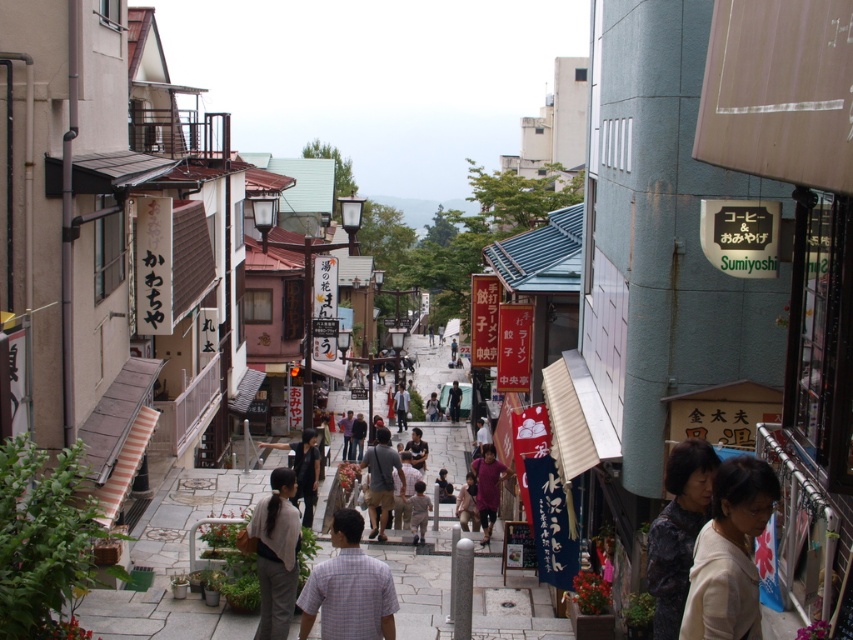
Does light brown leather bag at center have a smaller size compared to dark gray shirt at center?

A: Yes.

From the picture: Measure the distance from light brown leather bag at center to dark gray shirt at center.

light brown leather bag at center is 22.28 meters away from dark gray shirt at center.

Which is in front, point (380, 460) or point (346, 456)?

Point (380, 460) is in front.

The height and width of the screenshot is (640, 853). I want to click on light brown leather bag at center, so click(x=381, y=481).

Can you confirm if matte purple shirt at center is taller than dark gray shirt at center?

Yes.

Measure the distance from matte purple shirt at center to dark gray shirt at center.

matte purple shirt at center is 15.65 meters from dark gray shirt at center.

Does point (482, 458) lie behind point (346, 440)?

No, it is not.

Where is `matte purple shirt at center`? The image size is (853, 640). matte purple shirt at center is located at coordinates (488, 486).

Can you confirm if light beige sweater at lower right is smaller than light brown leather bag at center?

Actually, light beige sweater at lower right might be larger than light brown leather bag at center.

Measure the distance from light beige sweater at lower right to light brown leather bag at center.

light beige sweater at lower right and light brown leather bag at center are 38.59 feet apart.

Locate an element on the screen. This screenshot has width=853, height=640. light beige sweater at lower right is located at coordinates (729, 554).

At what (x,y) coordinates should I click in order to perform the action: click on light beige sweater at lower right. Please return your answer as a coordinate pair (x, y). This screenshot has height=640, width=853. Looking at the image, I should click on (729, 554).